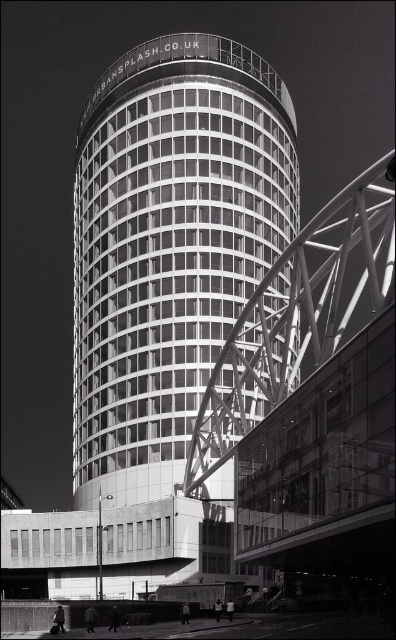
You are standing at the entrance of the complex and want to reach the smooth glass tower at center. According to the coordinates provided, in which direction should you move relative to your current position?

The smooth glass tower at center is located at point (169, 246), which means you should move towards the center of the image to reach it since the coordinates are close to the middle.